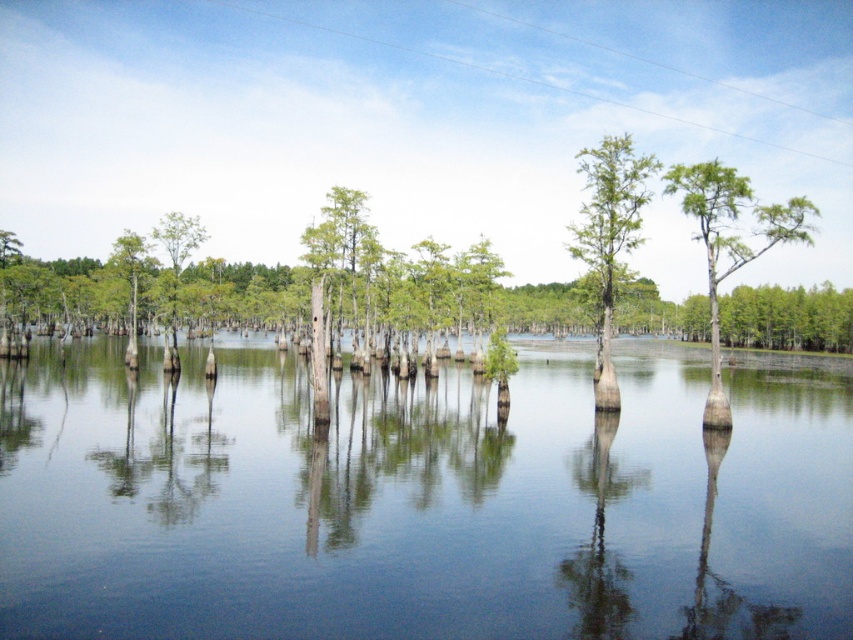
Between clear water at center and green matte tree at center, which one appears on the right side from the viewer's perspective?

green matte tree at center is more to the right.

Which is in front, point (289, 458) or point (607, 216)?

Point (289, 458) is more forward.

Where is `clear water at center`? The width and height of the screenshot is (853, 640). clear water at center is located at coordinates (422, 499).